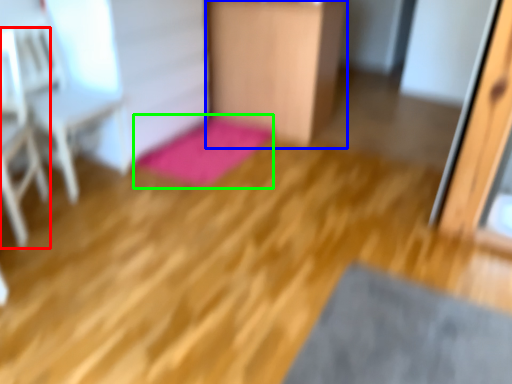
Question: Based on their relative distances, which object is farther from armchair (highlighted by a red box)? Choose from furniture (highlighted by a blue box) and bath mat (highlighted by a green box).

Choices:
 (A) furniture
 (B) bath mat

Answer: (A)